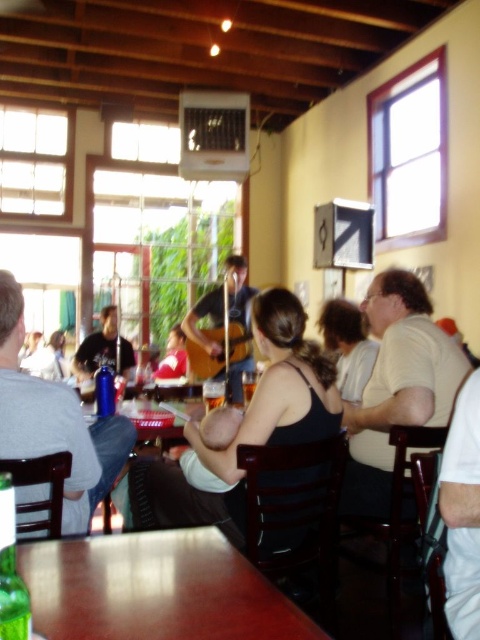
You are a waiter in a cafe and need to place a new order on the table. The order is for a customer wearing a matte black shirt at center. Which object should you approach first, the brown wooden table at lower center or another table? Explain your reasoning based on their sizes.

The brown wooden table at lower center is smaller than the matte black shirt at center. Since the customer is wearing the matte black shirt at center, the waiter should approach the brown wooden table at lower center because it is closer to the customer. However, the size comparison here might be confusing. Typically, tables are larger than shirts, so this might indicate a positioning issue. The answer should focus on the spatial relationship derived from the size difference provided.

You are a customer sitting at the brown wooden table at lower center and want to hand a napkin to the person wearing the matte black shirt at center. Can you reach them without leaving your seat?

The brown wooden table at lower center is below matte black shirt at center, so the person at the brown wooden table at lower center is sitting lower than the matte black shirt at center. Therefore, you can reach them without leaving your seat.